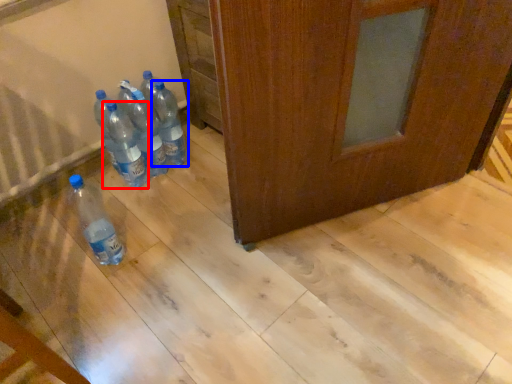
Question: Among these objects, which one is farthest to the camera, bottle (highlighted by a red box) or bottle (highlighted by a blue box)?

Choices:
 (A) bottle
 (B) bottle

Answer: (B)